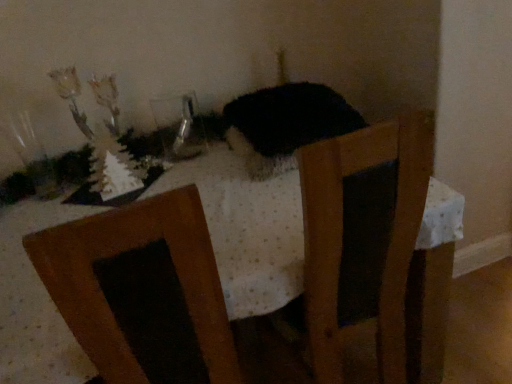
The image size is (512, 384). Identify the location of free location in front of transparent glass vase at upper left. (192, 168).